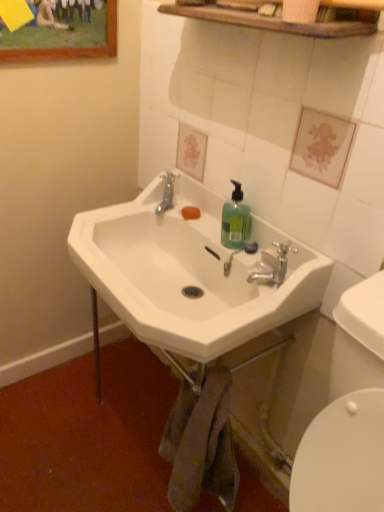
Question: Does translucent green liquid at sink right have a larger size compared to white ceramic sink at center?

Choices:
 (A) yes
 (B) no

Answer: (B)

Question: From a real-world perspective, is translucent green liquid at sink right positioned under white ceramic sink at center based on gravity?

Choices:
 (A) yes
 (B) no

Answer: (B)

Question: Is translucent green liquid at sink right directly adjacent to white ceramic sink at center?

Choices:
 (A) yes
 (B) no

Answer: (B)

Question: Is translucent green liquid at sink right oriented away from white ceramic sink at center?

Choices:
 (A) yes
 (B) no

Answer: (B)

Question: Is translucent green liquid at sink right wider than white ceramic sink at center?

Choices:
 (A) yes
 (B) no

Answer: (B)

Question: Would you say translucent green liquid at sink right is to the left or to the right of metallic silver faucet at lower center, the first plumbing fixture from the right, in the picture?

Choices:
 (A) left
 (B) right

Answer: (A)

Question: Is translucent green liquid at sink right wider or thinner than metallic silver faucet at lower center, which is the 2th plumbing fixture from back to front?

Choices:
 (A) thin
 (B) wide

Answer: (B)

Question: Relative to metallic silver faucet at lower center, positioned as the 1th plumbing fixture in bottom-to-top order, is translucent green liquid at sink right in front or behind?

Choices:
 (A) front
 (B) behind

Answer: (B)

Question: Considering the positions of translucent green liquid at sink right and metallic silver faucet at lower center, which is the 2th plumbing fixture from back to front, in the image, is translucent green liquid at sink right taller or shorter than metallic silver faucet at lower center, which is the 2th plumbing fixture from back to front,?

Choices:
 (A) short
 (B) tall

Answer: (B)

Question: Considering the positions of metallic silver faucet at lower center, the second plumbing fixture viewed from the left, and silver metallic faucet at upper center, which is the 2th plumbing fixture from front to back, in the image, is metallic silver faucet at lower center, the second plumbing fixture viewed from the left, wider or thinner than silver metallic faucet at upper center, which is the 2th plumbing fixture from front to back,?

Choices:
 (A) thin
 (B) wide

Answer: (A)

Question: Visually, is metallic silver faucet at lower center, the first plumbing fixture from the right, positioned to the left or to the right of silver metallic faucet at upper center, which is the 2th plumbing fixture from front to back?

Choices:
 (A) left
 (B) right

Answer: (B)

Question: Considering the positions of point (283, 280) and point (170, 200), is point (283, 280) closer or farther from the camera than point (170, 200)?

Choices:
 (A) closer
 (B) farther

Answer: (A)

Question: From the image's perspective, is metallic silver faucet at lower center, the second plumbing fixture viewed from the left, above or below silver metallic faucet at upper center, which is the 2th plumbing fixture from front to back?

Choices:
 (A) below
 (B) above

Answer: (A)

Question: From the image's perspective, relative to metallic silver faucet at lower center, which is the 2th plumbing fixture from back to front, is silver metallic faucet at upper center, which is the 2th plumbing fixture from front to back, above or below?

Choices:
 (A) below
 (B) above

Answer: (B)

Question: Is silver metallic faucet at upper center, marked as the 1th plumbing fixture in a back-to-front arrangement, in front of or behind metallic silver faucet at lower center, the second plumbing fixture viewed from the left, in the image?

Choices:
 (A) behind
 (B) front

Answer: (A)